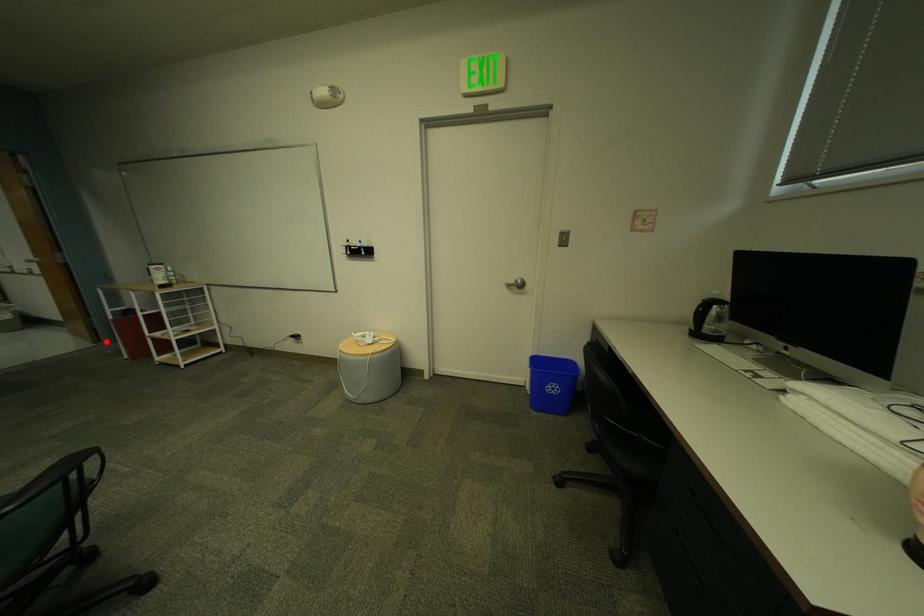
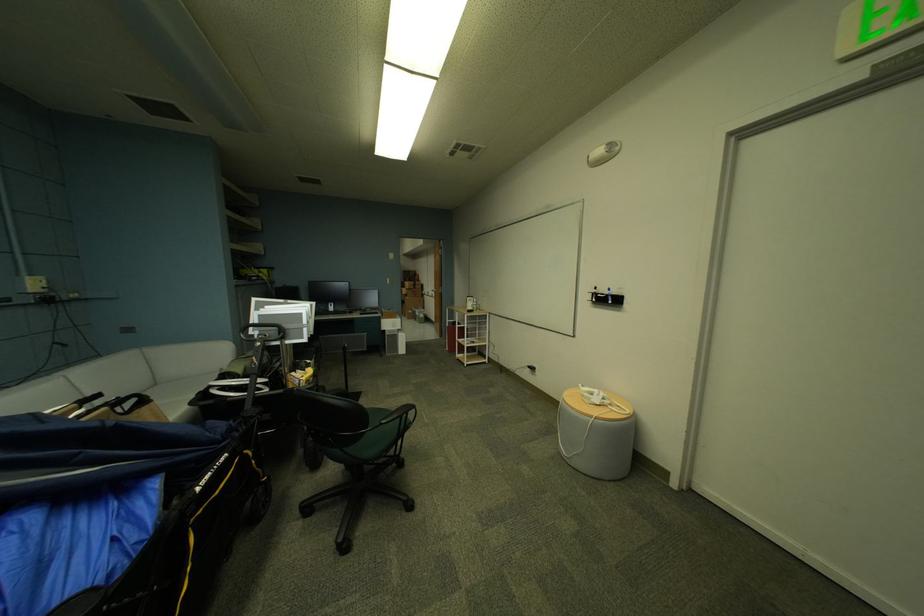
Question: I am providing you with two images of the same scene from different viewpoints. In image1, a red point is highlighted. Considering the same 3D point in image2, which of the following is correct?

Choices:
 (A) It is closer
 (B) It is farther

Answer: (B)